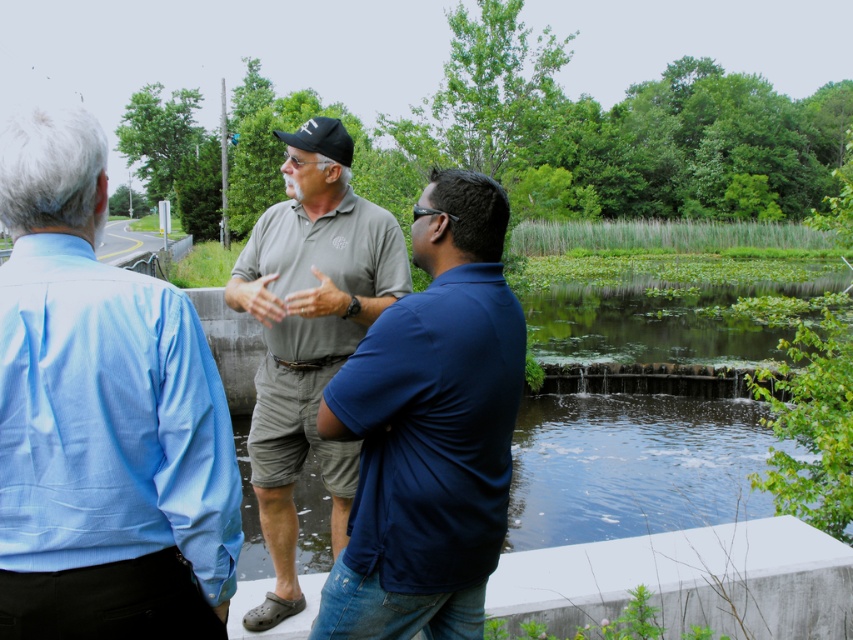
Is matte green polo shirt at center above matte gray polo shirt at center?

Incorrect, matte green polo shirt at center is not positioned above matte gray polo shirt at center.

Measure the distance from matte green polo shirt at center to matte gray polo shirt at center.

The distance of matte green polo shirt at center from matte gray polo shirt at center is 37.58 inches.

Find the location of `matte green polo shirt at center`. matte green polo shirt at center is located at coordinates click(x=99, y=413).

Between point (187, 448) and point (509, 374), which one is positioned behind?

The point (509, 374) is behind.

The width and height of the screenshot is (853, 640). What are the coordinates of `light blue shirt at left` in the screenshot? It's located at (102, 417).

You are a GUI agent. You are given a task and a screenshot of the screen. Output one action in this format:
    pyautogui.click(x=<x>, y=<y>)
    Task: Click on the light blue shirt at left
    Image resolution: width=853 pixels, height=640 pixels.
    Given the screenshot: What is the action you would take?
    pyautogui.click(x=102, y=417)

Identify the location of light blue shirt at left. The image size is (853, 640). (102, 417).

Does light blue shirt at left have a larger size compared to matte gray polo shirt at center?

Incorrect, light blue shirt at left is not larger than matte gray polo shirt at center.

Looking at this image, between light blue shirt at left and matte gray polo shirt at center, which one is positioned lower?

Positioned lower is light blue shirt at left.

Image resolution: width=853 pixels, height=640 pixels. What are the coordinates of `light blue shirt at left` in the screenshot? It's located at (102, 417).